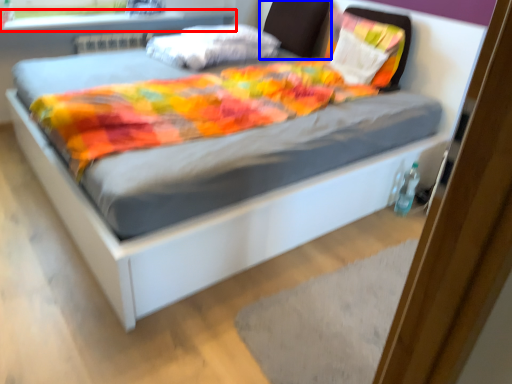
Question: Among these objects, which one is farthest to the camera, window sill (highlighted by a red box) or headboard (highlighted by a blue box)?

Choices:
 (A) window sill
 (B) headboard

Answer: (B)